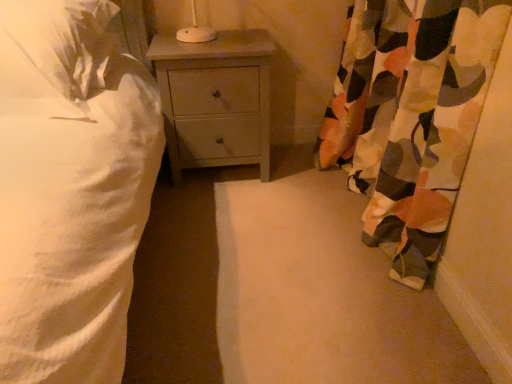
Question: Considering the relative positions of white soft pillow at upper left and light gray wood nightstand at center in the image provided, is white soft pillow at upper left behind light gray wood nightstand at center?

Choices:
 (A) yes
 (B) no

Answer: (B)

Question: Can you confirm if white soft pillow at upper left is wider than light gray wood nightstand at center?

Choices:
 (A) yes
 (B) no

Answer: (A)

Question: Considering the relative sizes of white soft pillow at upper left and light gray wood nightstand at center in the image provided, is white soft pillow at upper left thinner than light gray wood nightstand at center?

Choices:
 (A) no
 (B) yes

Answer: (A)

Question: From a real-world perspective, is white soft pillow at upper left on top of light gray wood nightstand at center?

Choices:
 (A) yes
 (B) no

Answer: (A)

Question: Does white soft pillow at upper left contain light gray wood nightstand at center?

Choices:
 (A) yes
 (B) no

Answer: (B)

Question: From a real-world perspective, is camouflage fabric curtain at right positioned above or below light gray wood nightstand at center?

Choices:
 (A) below
 (B) above

Answer: (B)

Question: Would you say camouflage fabric curtain at right is inside or outside light gray wood nightstand at center?

Choices:
 (A) outside
 (B) inside

Answer: (A)

Question: Relative to light gray wood nightstand at center, is camouflage fabric curtain at right in front or behind?

Choices:
 (A) behind
 (B) front

Answer: (B)

Question: Considering the positions of camouflage fabric curtain at right and light gray wood nightstand at center in the image, is camouflage fabric curtain at right taller or shorter than light gray wood nightstand at center?

Choices:
 (A) short
 (B) tall

Answer: (B)

Question: From the image's perspective, relative to camouflage fabric curtain at right, is white soft pillow at upper left above or below?

Choices:
 (A) above
 (B) below

Answer: (A)

Question: In the image, is white soft pillow at upper left positioned in front of or behind camouflage fabric curtain at right?

Choices:
 (A) behind
 (B) front

Answer: (A)

Question: From a real-world perspective, is white soft pillow at upper left physically located above or below camouflage fabric curtain at right?

Choices:
 (A) above
 (B) below

Answer: (A)

Question: Considering the relative positions of white soft pillow at upper left and camouflage fabric curtain at right in the image provided, is white soft pillow at upper left to the left or to the right of camouflage fabric curtain at right?

Choices:
 (A) left
 (B) right

Answer: (A)

Question: Looking at their shapes, would you say white soft pillow at upper left is wider or thinner than light gray wood nightstand at center?

Choices:
 (A) thin
 (B) wide

Answer: (B)

Question: Considering the positions of point (32, 51) and point (265, 54), is point (32, 51) closer or farther from the camera than point (265, 54)?

Choices:
 (A) closer
 (B) farther

Answer: (A)